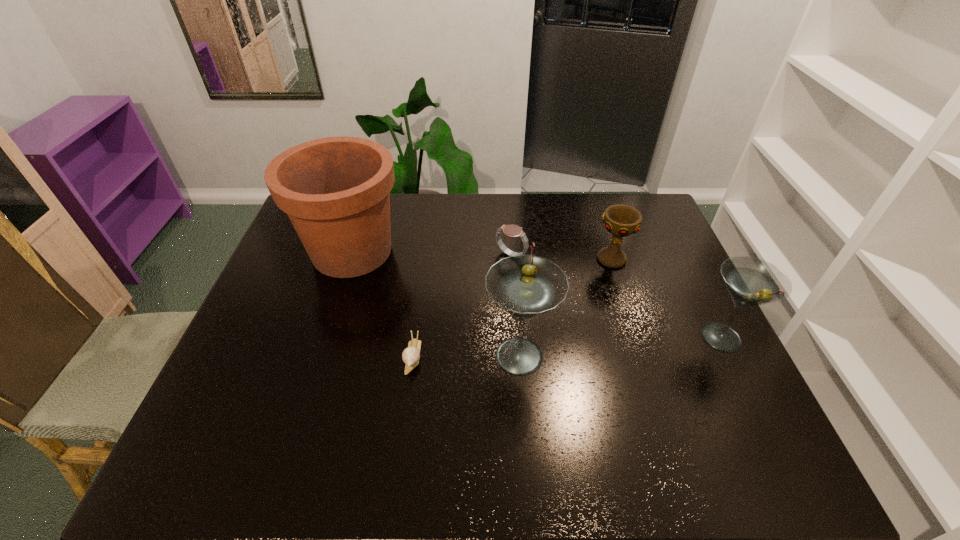
Image resolution: width=960 pixels, height=540 pixels. In order to click on unoccupied position between the flowerpot and the left martini in this screenshot , I will do `click(436, 303)`.

At what (x,y) coordinates should I click in order to perform the action: click on vacant area that lies between the taller martini and the flowerpot. Please return your answer as a coordinate pair (x, y). The width and height of the screenshot is (960, 540). Looking at the image, I should click on (436, 303).

Choose which object is the fifth nearest neighbor to the watch. Please provide its 2D coordinates. Your answer should be formatted as a tuple, i.e. [(x, y)], where the tuple contains the x and y coordinates of a point satisfying the conditions above.

[(750, 281)]

Locate which object is the closest to the left martini. Please provide its 2D coordinates. Your answer should be formatted as a tuple, i.e. [(x, y)], where the tuple contains the x and y coordinates of a point satisfying the conditions above.

[(411, 355)]

You are a GUI agent. You are given a task and a screenshot of the screen. Output one action in this format:
    pyautogui.click(x=<x>, y=<y>)
    Task: Click on the blank space that satisfies the following two spatial constraints: 1. on the front side of the fifth tallest object; 2. on the left side of the flowerpot
    The image size is (960, 540).
    Given the screenshot: What is the action you would take?
    pyautogui.click(x=351, y=255)